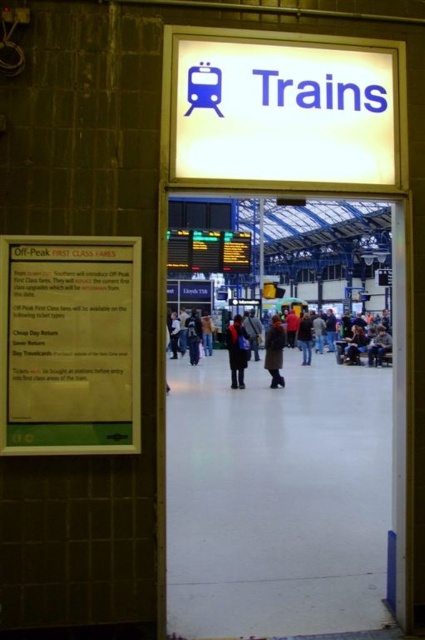
Question: Is transparent glass door at center below dark blue jacket at right?

Choices:
 (A) yes
 (B) no

Answer: (B)

Question: Which point is closer to the camera?

Choices:
 (A) transparent glass door at center
 (B) dark blue jeans at center
 (C) dark blue jacket at right
 (D) dark brown coat at center

Answer: (A)

Question: Does dark brown leather coat at center appear on the left side of dark brown coat at center?

Choices:
 (A) yes
 (B) no

Answer: (B)

Question: Where is green paper sign at left located in relation to dark blue jeans at center in the image?

Choices:
 (A) left
 (B) right

Answer: (A)

Question: Which object is positioned farthest from the dark blue jacket at right?

Choices:
 (A) dark brown coat at center
 (B) green paper sign at left
 (C) dark blue jeans at center

Answer: (B)

Question: Among these points, which one is farthest from the camera?

Choices:
 (A) 306,360
 (B) 272,353

Answer: (A)